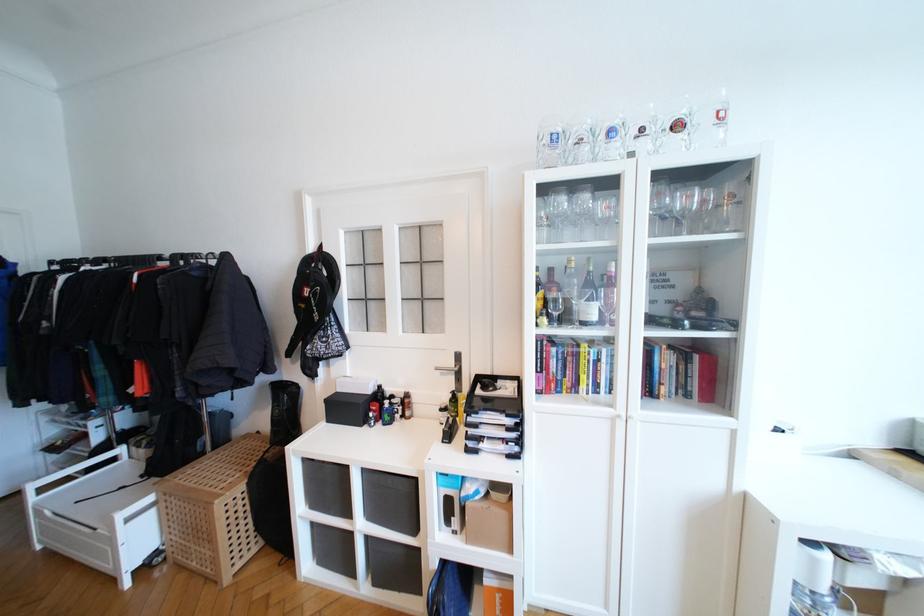
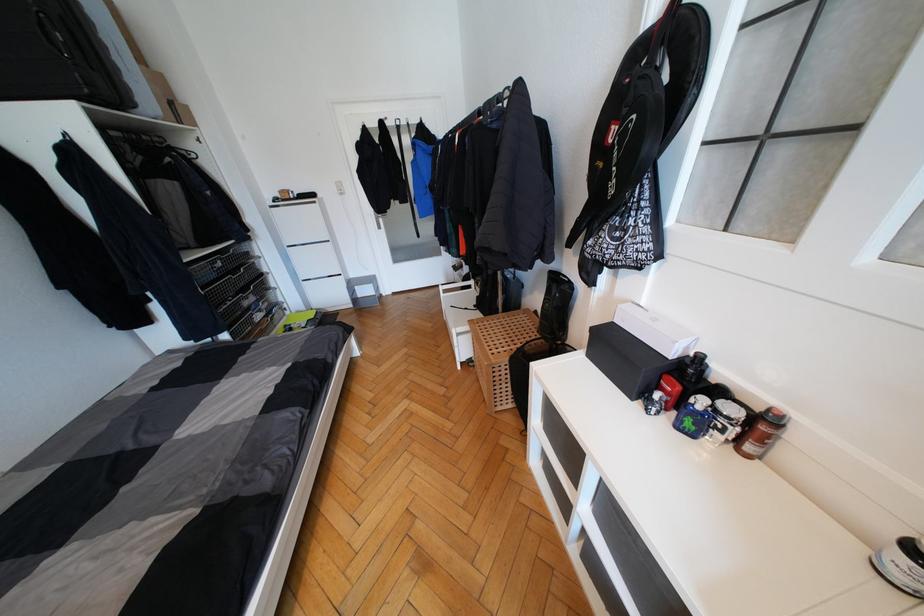
Find the pixel in the second image that matches the point at 444,411 in the first image.

(916, 551)